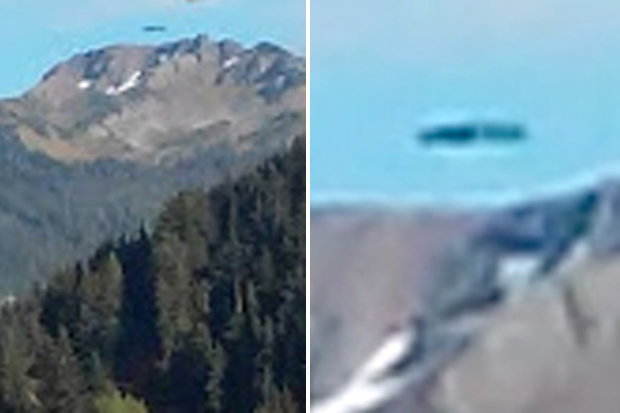
Where is `panel`? The width and height of the screenshot is (620, 413). panel is located at coordinates (364, 222), (217, 227).